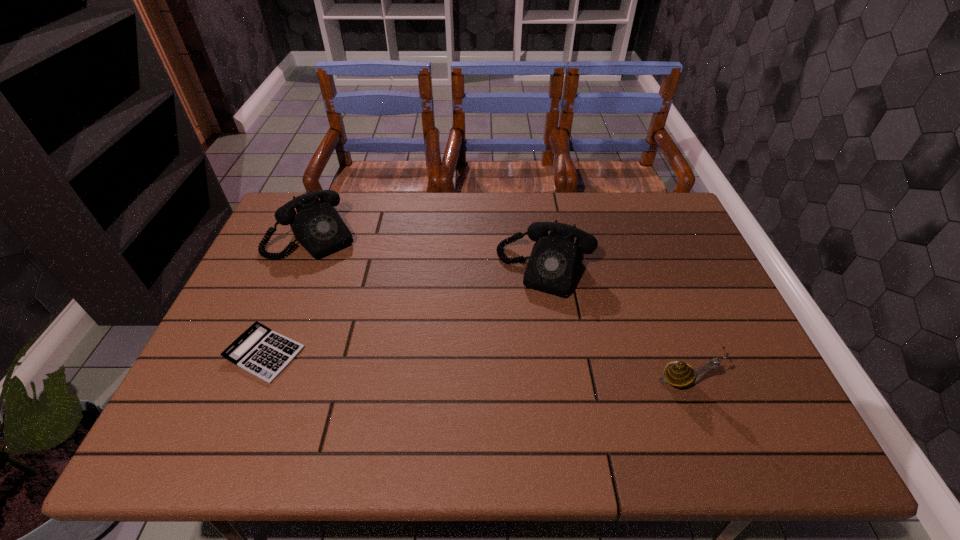
The image size is (960, 540). Find the location of `the shortest object`. the shortest object is located at coordinates (259, 350).

Image resolution: width=960 pixels, height=540 pixels. Find the location of `the rightmost object`. the rightmost object is located at coordinates (679, 374).

Locate an element on the screen. the right telephone is located at coordinates (555, 261).

What are the coordinates of `the left telephone` in the screenshot? It's located at [317, 226].

I want to click on free location located 0.380m on the back of the shortest object, so click(x=315, y=233).

Identify the location of vacant space located 0.060m on the face of the rightmost object. (735, 380).

The height and width of the screenshot is (540, 960). Find the location of `free space located 0.250m on the dial of the third object from left to right`. free space located 0.250m on the dial of the third object from left to right is located at coordinates (499, 369).

You are a GUI agent. You are given a task and a screenshot of the screen. Output one action in this format:
    pyautogui.click(x=<x>, y=<y>)
    Task: Click on the vacant region located on the dial of the third object from left to right
    This screenshot has width=960, height=540.
    Given the screenshot: What is the action you would take?
    pyautogui.click(x=509, y=347)

The image size is (960, 540). I want to click on free spot located on the dial of the third object from left to right, so click(503, 360).

You are a GUI agent. You are given a task and a screenshot of the screen. Output one action in this format:
    pyautogui.click(x=<x>, y=<y>)
    Task: Click on the vacant region located 0.320m on the dial of the left telephone
    
    Given the screenshot: What is the action you would take?
    pyautogui.click(x=386, y=320)